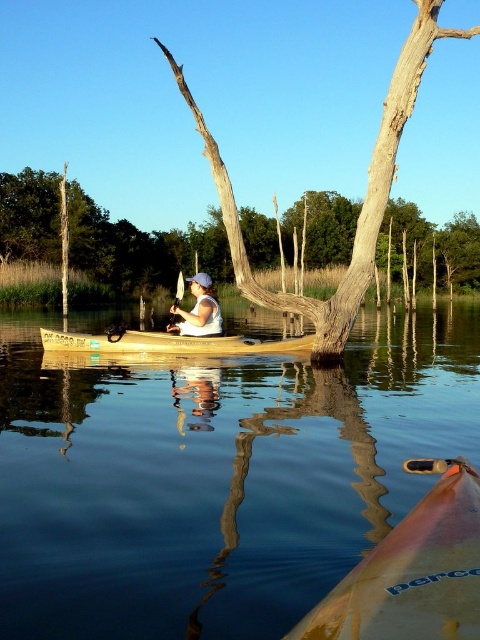
Question: Which point is farther to the camera?

Choices:
 (A) (304, 344)
 (B) (84, 198)
 (C) (211, 307)

Answer: (B)

Question: Is brown rough tree trunk at center thinner than white fabric umbrella at center?

Choices:
 (A) no
 (B) yes

Answer: (A)

Question: Among these points, which one is farthest from the camera?

Choices:
 (A) (172, 317)
 (B) (129, 332)

Answer: (B)

Question: Considering the relative positions of smooth bark tree at center and white plastic paddle at center in the image provided, where is smooth bark tree at center located with respect to white plastic paddle at center?

Choices:
 (A) left
 (B) right

Answer: (B)

Question: Is brown rough tree trunk at center in front of white fabric umbrella at center?

Choices:
 (A) no
 (B) yes

Answer: (B)

Question: Estimate the real-world distances between objects in this image. Which object is farther from the clear water at center?

Choices:
 (A) smooth bark tree at center
 (B) yellow plastic kayak at lower right
 (C) wooden canoe at center
 (D) brown rough tree trunk at center

Answer: (A)